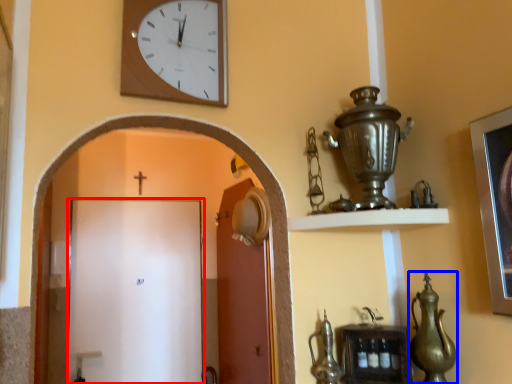
Question: Which object appears farthest to the camera in this image, door (highlighted by a red box) or tea pot (highlighted by a blue box)?

Choices:
 (A) door
 (B) tea pot

Answer: (A)